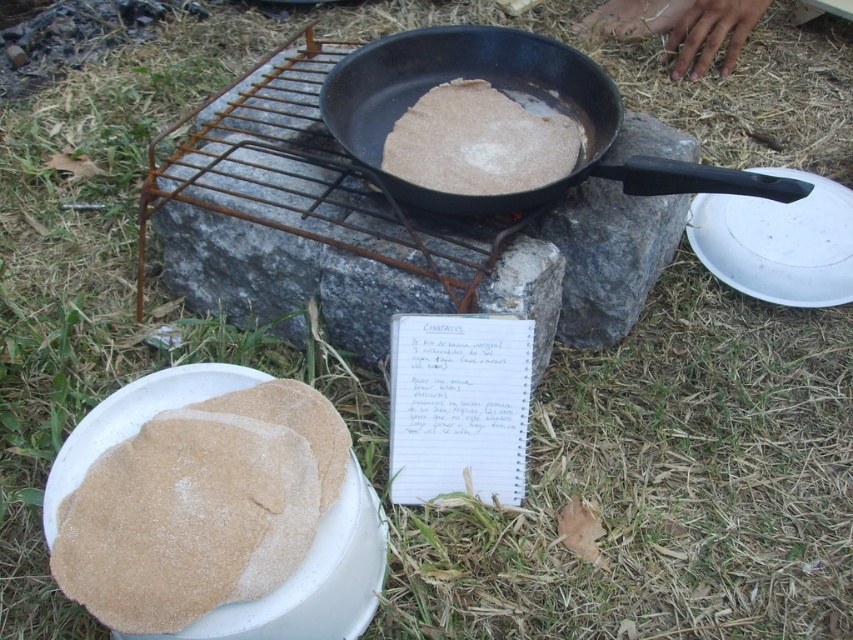
You are a chef trying to arrange the brown matte flatbread at lower left and the brown matte flatbread at center for a photo shoot. According to their positions, which flatbread should you adjust to make them aligned horizontally?

The brown matte flatbread at lower left is below the brown matte flatbread at center. To align them horizontally, you should move the brown matte flatbread at lower left upward to match the height of the brown matte flatbread at center.

You are standing at the origin point in the image. Which of the two points, point [344,115] or point [421,129], is closer to you?

Point [344,115] is closer to you because it is in front of point [421,129].